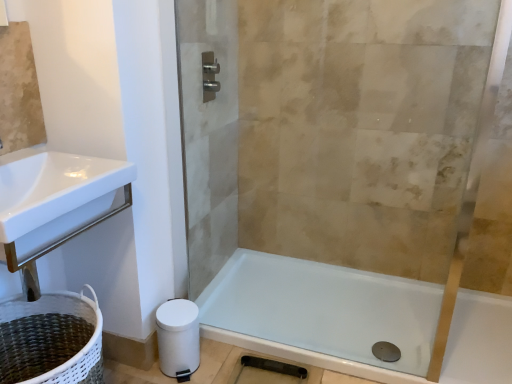
This screenshot has width=512, height=384. What do you see at coordinates (178, 336) in the screenshot?
I see `white matte toilet paper at lower left` at bounding box center [178, 336].

The height and width of the screenshot is (384, 512). I want to click on white matte toilet paper at lower left, so click(178, 336).

Where is `satin nickel towel bar at upper center`? satin nickel towel bar at upper center is located at coordinates (210, 76).

Are white woven laundry basket at lower left and satin nickel towel bar at upper center located far from each other?

Yes, white woven laundry basket at lower left and satin nickel towel bar at upper center are located far from each other.

From a real-world perspective, between white woven laundry basket at lower left and satin nickel towel bar at upper center, who is vertically lower?

white woven laundry basket at lower left is physically lower.

Between white woven laundry basket at lower left and satin nickel towel bar at upper center, which one has larger width?

With larger width is white woven laundry basket at lower left.

Is white woven laundry basket at lower left not within satin nickel towel bar at upper center?

Yes, white woven laundry basket at lower left is not within satin nickel towel bar at upper center.

Locate an element on the screen. This screenshot has height=384, width=512. screen door lying above the white glossy bathtub at lower right (from the image's perspective) is located at coordinates (208, 133).

Which of these two, clear glass shower door at center or white glossy bathtub at lower right, stands shorter?

Standing shorter between the two is white glossy bathtub at lower right.

Can you confirm if clear glass shower door at center is thinner than white glossy bathtub at lower right?

Yes, clear glass shower door at center is thinner than white glossy bathtub at lower right.

Based on the photo, is white glossy bathtub at lower right wider or thinner than white woven laundry basket at lower left?

Considering their sizes, white glossy bathtub at lower right looks broader than white woven laundry basket at lower left.

Is white glossy bathtub at lower right taller than white woven laundry basket at lower left?

Incorrect, the height of white glossy bathtub at lower right is not larger of that of white woven laundry basket at lower left.

From the image's perspective, does white glossy bathtub at lower right appear higher than white woven laundry basket at lower left?

No, from the image's perspective, white glossy bathtub at lower right is not on top of white woven laundry basket at lower left.

Is clear glass shower door at center oriented towards satin nickel towel bar at upper center?

Yes.

At what (x,y) coordinates should I click in order to perform the action: click on towel bar above the clear glass shower door at center (from the image's perspective). Please return your answer as a coordinate pair (x, y). The image size is (512, 384). Looking at the image, I should click on (210, 76).

Considering the relative positions of clear glass shower door at center and satin nickel towel bar at upper center in the image provided, is clear glass shower door at center behind satin nickel towel bar at upper center?

No.

From the image's perspective, which one is positioned higher, clear glass shower door at center or satin nickel towel bar at upper center?

From the image's view, satin nickel towel bar at upper center is above.

Based on the photo, between white woven laundry basket at lower left and clear glass shower door at center, which one has smaller width?

clear glass shower door at center is thinner.

Could you tell me if white woven laundry basket at lower left is facing clear glass shower door at center?

No, white woven laundry basket at lower left does not turn towards clear glass shower door at center.

Are white woven laundry basket at lower left and clear glass shower door at center located far from each other?

No.

Does white woven laundry basket at lower left have a smaller size compared to clear glass shower door at center?

Incorrect, white woven laundry basket at lower left is not smaller in size than clear glass shower door at center.

How different are the orientations of white matte toilet paper at lower left and white woven laundry basket at lower left in degrees?

0.15 degrees.

Could you measure the distance between white matte toilet paper at lower left and white woven laundry basket at lower left?

white matte toilet paper at lower left and white woven laundry basket at lower left are 15.08 inches apart.

Is white matte toilet paper at lower left looking in the opposite direction of white woven laundry basket at lower left?

No.

From a real-world perspective, relative to white woven laundry basket at lower left, is white matte toilet paper at lower left vertically above or below?

Clearly, from a real-world perspective, white matte toilet paper at lower left is below white woven laundry basket at lower left.

This screenshot has width=512, height=384. In order to click on toilet paper lying behind the white glossy bathtub at lower right in this screenshot , I will do `click(178, 336)`.

Between white glossy bathtub at lower right and white matte toilet paper at lower left, which one appears on the left side from the viewer's perspective?

white matte toilet paper at lower left is more to the left.

Find the location of a particular element. This screenshot has height=384, width=512. towel bar on the right of white woven laundry basket at lower left is located at coordinates (210, 76).

Image resolution: width=512 pixels, height=384 pixels. In order to click on bathtub lying in front of the clear glass shower door at center in this screenshot , I will do `click(322, 314)`.

Which object lies nearer to the anchor point white glossy bathtub at lower right, clear glass shower door at center or satin nickel towel bar at upper center?

clear glass shower door at center is closer to white glossy bathtub at lower right.

When comparing their distances from white glossy bathtub at lower right, does clear glass shower door at center or white matte toilet paper at lower left seem further?

clear glass shower door at center.

Looking at this image, considering their positions, is white glossy bathtub at lower right positioned further to white woven laundry basket at lower left than white matte toilet paper at lower left?

The object further to white woven laundry basket at lower left is white glossy bathtub at lower right.

Which object lies further to the anchor point clear glass shower door at center, white matte toilet paper at lower left or white woven laundry basket at lower left?

Based on the image, white woven laundry basket at lower left appears to be further to clear glass shower door at center.

Based on their spatial positions, is clear glass shower door at center or white glossy bathtub at lower right further from satin nickel towel bar at upper center?

Among the two, white glossy bathtub at lower right is located further to satin nickel towel bar at upper center.

Which object lies nearer to the anchor point satin nickel towel bar at upper center, white woven laundry basket at lower left or white glossy bathtub at lower right?

white woven laundry basket at lower left is positioned closer to the anchor satin nickel towel bar at upper center.

From the image, which object appears to be nearer to white glossy bathtub at lower right, white woven laundry basket at lower left or clear glass shower door at center?

Based on the image, clear glass shower door at center appears to be nearer to white glossy bathtub at lower right.

Based on their spatial positions, is white glossy bathtub at lower right or clear glass shower door at center closer to white woven laundry basket at lower left?

Based on the image, clear glass shower door at center appears to be nearer to white woven laundry basket at lower left.

You are a GUI agent. You are given a task and a screenshot of the screen. Output one action in this format:
    pyautogui.click(x=<x>, y=<y>)
    Task: Click on the screen door situated between white woven laundry basket at lower left and white glossy bathtub at lower right from left to right
    Image resolution: width=512 pixels, height=384 pixels.
    Given the screenshot: What is the action you would take?
    pyautogui.click(x=208, y=133)

I want to click on toilet paper between clear glass shower door at center and white woven laundry basket at lower left vertically, so click(x=178, y=336).

Locate an element on the screen. The height and width of the screenshot is (384, 512). screen door between satin nickel towel bar at upper center and white matte toilet paper at lower left in the up-down direction is located at coordinates (208, 133).

Locate an element on the screen. laundry basket between satin nickel towel bar at upper center and white glossy bathtub at lower right vertically is located at coordinates (51, 339).